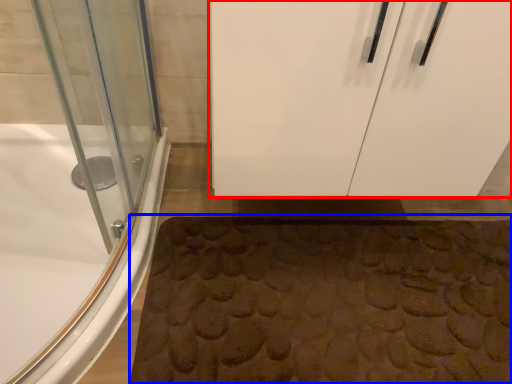
Question: Which object is further to the camera taking this photo, door (highlighted by a red box) or bath mat (highlighted by a blue box)?

Choices:
 (A) door
 (B) bath mat

Answer: (B)